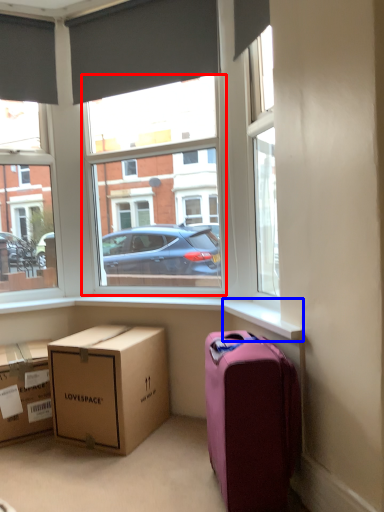
Question: Which of the following is the closest to the observer, window frame (highlighted by a red box) or window sill (highlighted by a blue box)?

Choices:
 (A) window frame
 (B) window sill

Answer: (B)